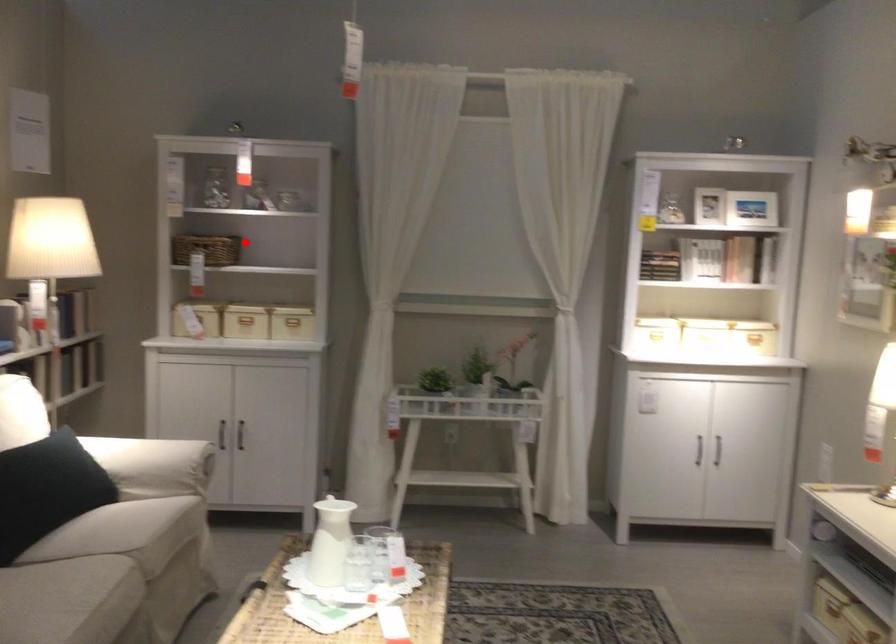
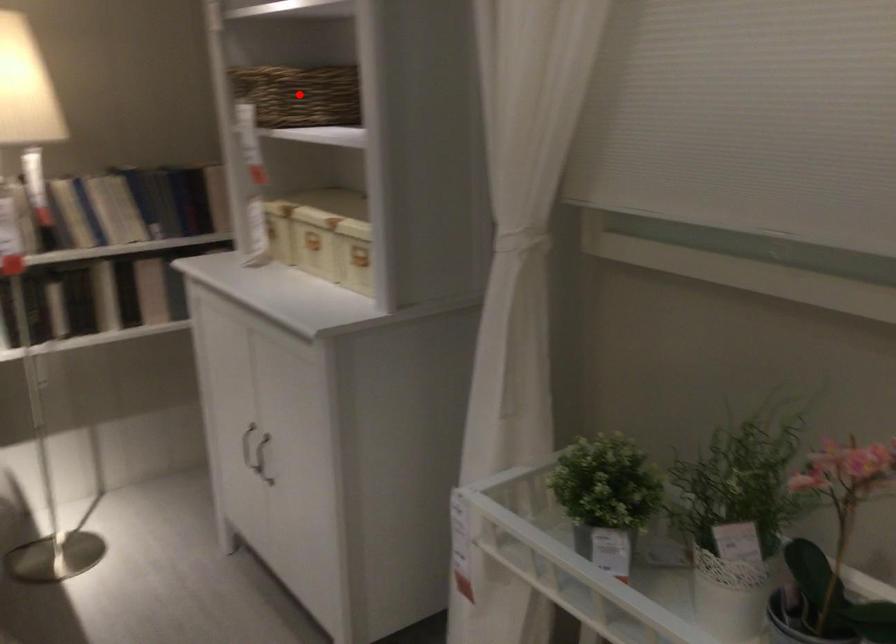
I am providing you with two images of the same scene from different viewpoints. A red point is marked on the first image and another point is marked on the second image. Do the highlighted points in image1 and image2 indicate the same real-world spot?

Yes